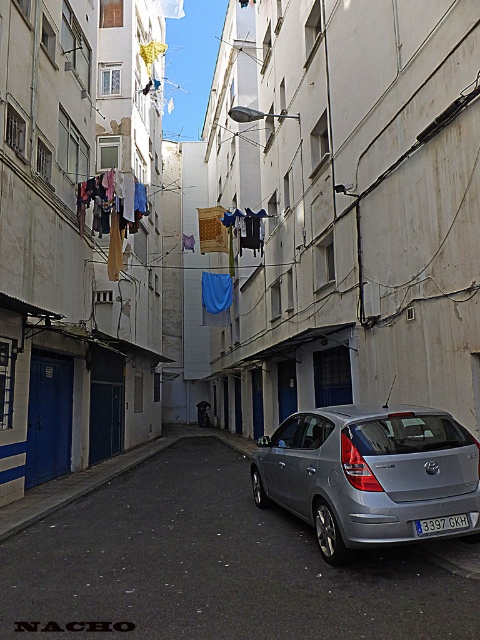
You are standing in the alleyway and want to place a small potted plant between the two points marked as point (402, 605) and point (422, 529). Which point should the plant be closer to in order to be nearer to the viewer?

The plant should be placed closer to point (402, 605) because it is closer to the viewer than point (422, 529).

You are a delivery person trying to park a car that is exactly the same height as the blue metallic license plate at center in the alleyway. Based on the scene, can the silver metallic car at center fit in terms of height without any modifications?

The silver metallic car at center is taller than the blue metallic license plate at center. Since your car is the same height as the blue metallic license plate at center, it would be shorter than the silver metallic car at center, so it should fit in terms of height.

You are driving a car that is 4 feet wide. You see the satin silver hatchback at center and the blue metallic license plate at center in the alleyway. Can your car pass between them without touching either?

The distance between the satin silver hatchback at center and the blue metallic license plate at center is 38.17 inches, which is approximately 3.18 feet. Since your car is 4 feet wide, it cannot pass through the space between them without touching either object.